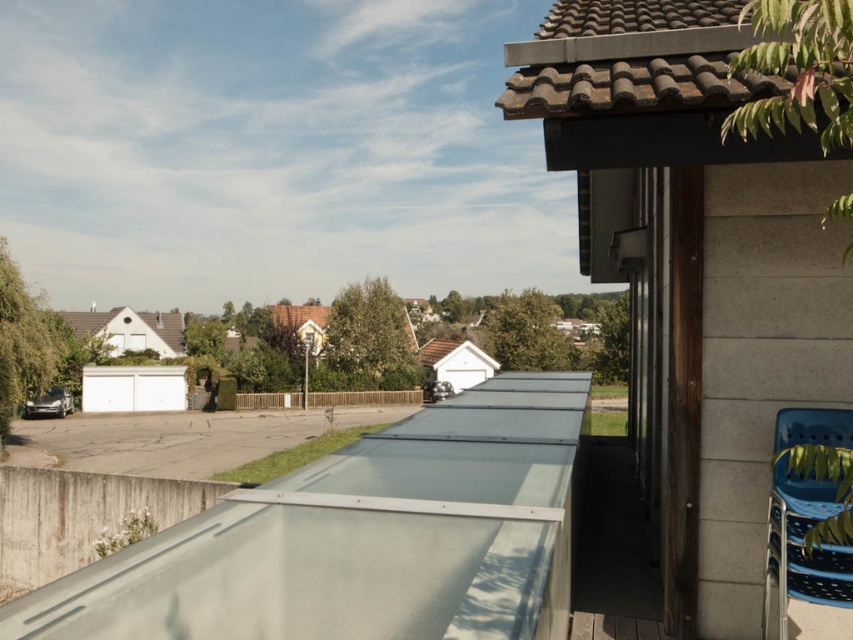
You are standing on the balcony and want to move from the blue plastic chair at lower right to the brown wooden fence at center. Which direction should you move to reach the fence?

The blue plastic chair at lower right is in front of the brown wooden fence at center, so you should move backward to reach the fence.

You are standing on the balcony and want to see the brown wooden fence at center. Which direction should you look relative to the transparent glass balcony at lower center?

The transparent glass balcony at lower center is positioned on the right side of the brown wooden fence at center, so you should look to the left of the transparent glass balcony at lower center to see the brown wooden fence at center.